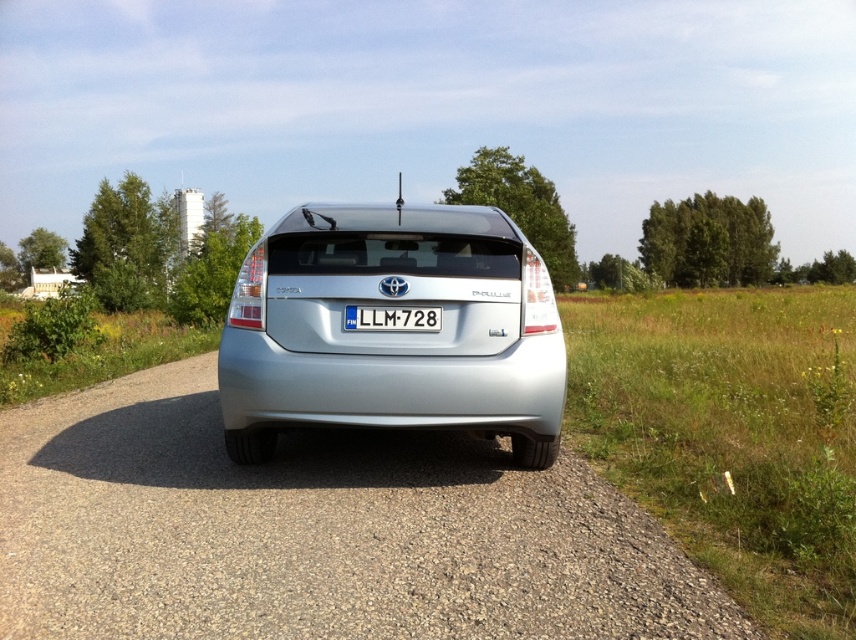
Question: Is satin silver car at center below white plastic license plate at center?

Choices:
 (A) no
 (B) yes

Answer: (A)

Question: Is the position of satin silver car at center more distant than that of white plastic license plate at center?

Choices:
 (A) no
 (B) yes

Answer: (B)

Question: Does satin silver car at center have a smaller size compared to white plastic license plate at center?

Choices:
 (A) no
 (B) yes

Answer: (A)

Question: Among these points, which one is nearest to the camera?

Choices:
 (A) (395, 352)
 (B) (377, 316)

Answer: (A)